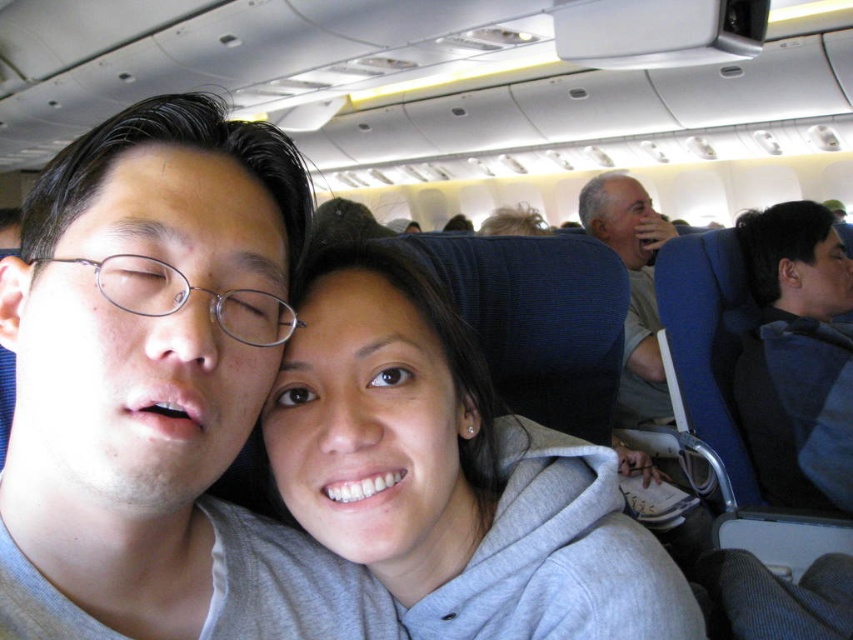
You are sitting in an airplane cabin and notice two items in your line of sight. One is the matte gray hoodie at center and the other is the dark blue fabric at right. Which of these two items is positioned to the left?

The matte gray hoodie at center is positioned to the left of the dark blue fabric at right.

You are a flight attendant carrying a 5 feet long tray. You need to place it between the matte gray hoodie at center and the gray cotton shirt at upper right. Is there enough space?

The distance between the matte gray hoodie at center and the gray cotton shirt at upper right is 5.50 feet. Since the tray is 5 feet long, there is enough space to place it between them with 0.5 feet of clearance.

From the picture: You are a flight attendant checking seat assignments. You see the gray fleece at center and the gray cotton shirt at upper right. Which one is closer to the front of the airplane cabin?

The gray fleece at center is closer to the front of the airplane cabin because it is in front of the gray cotton shirt at upper right.